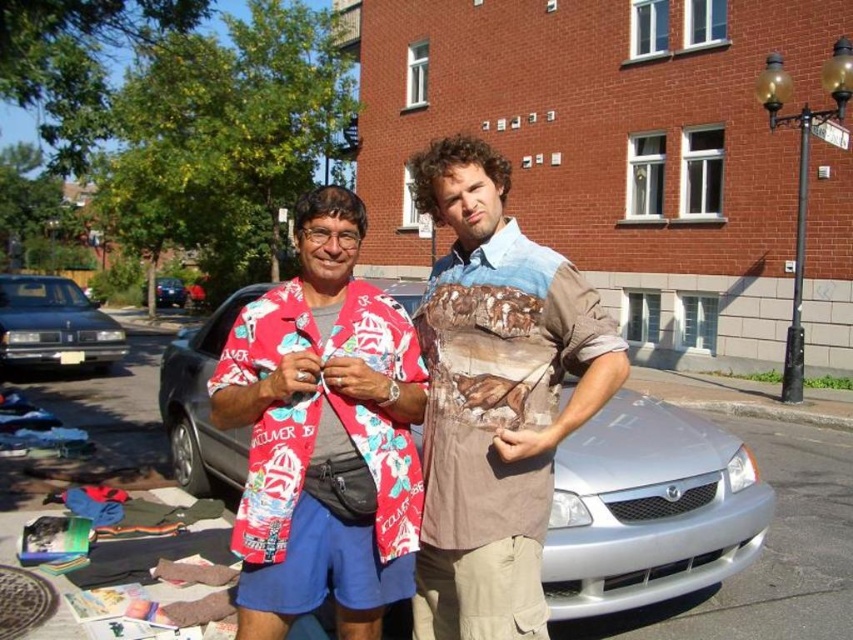
Question: Is floral fabric shirt at center further to the viewer compared to matte black sedan at left?

Choices:
 (A) no
 (B) yes

Answer: (A)

Question: Is hawaiian fabric shirt at center closer to camera compared to shiny black sedan at left?

Choices:
 (A) no
 (B) yes

Answer: (B)

Question: Which point is closer to the camera taking this photo?

Choices:
 (A) (169, 296)
 (B) (433, 605)

Answer: (B)

Question: Which point is farther to the camera?

Choices:
 (A) floral fabric shirt at center
 (B) shiny black sedan at left
 (C) matte black sedan at left

Answer: (B)

Question: Which of the following is the farthest from the observer?

Choices:
 (A) [107, 339]
 (B) [413, 624]
 (C) [293, 440]
 (D) [165, 301]

Answer: (D)

Question: Does floral fabric shirt at center lie in front of hawaiian fabric shirt at center?

Choices:
 (A) no
 (B) yes

Answer: (A)